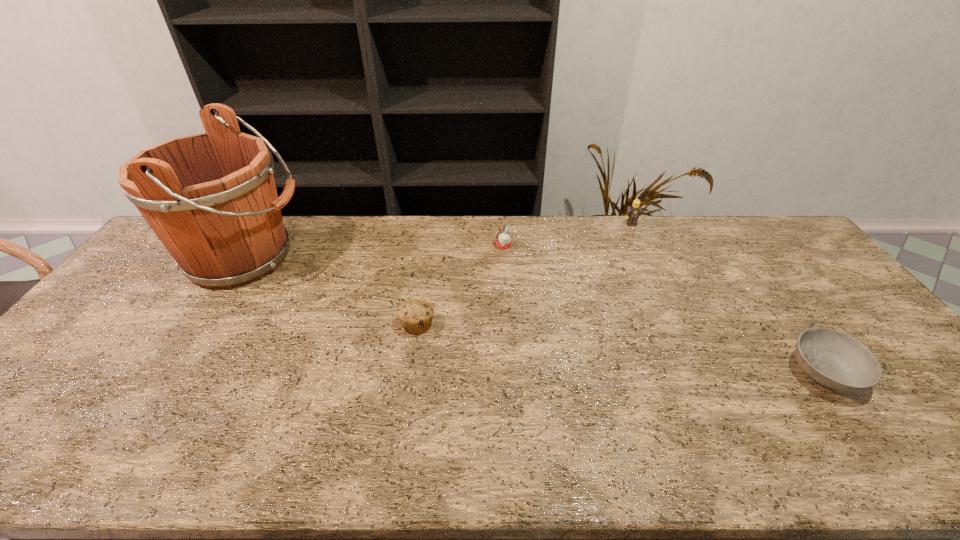
Find the location of a particular element. free space between the right muffin and the nearest object is located at coordinates (664, 309).

This screenshot has width=960, height=540. Identify the location of free spot between the fourth shortest object and the second object from left to right. (524, 274).

At what (x,y) coordinates should I click in order to perform the action: click on free space that is in between the Lego and the second object from left to right. Please return your answer as a coordinate pair (x, y). This screenshot has height=540, width=960. Looking at the image, I should click on (524, 274).

Where is `empty space that is in between the left muffin and the rightmost object`? empty space that is in between the left muffin and the rightmost object is located at coordinates (621, 349).

You are a GUI agent. You are given a task and a screenshot of the screen. Output one action in this format:
    pyautogui.click(x=<x>, y=<y>)
    Task: Click on the vacant area between the second tallest object and the right muffin
    The width and height of the screenshot is (960, 540).
    Given the screenshot: What is the action you would take?
    pyautogui.click(x=567, y=235)

At what (x,y) coordinates should I click in order to perform the action: click on blank region between the bowl and the fourth farthest object. Please return your answer as a coordinate pair (x, y). This screenshot has height=540, width=960. Looking at the image, I should click on (621, 349).

I want to click on free space between the tallest object and the nearer muffin, so click(x=331, y=291).

What are the coordinates of `the third closest object relative to the right muffin` in the screenshot? It's located at (211, 198).

Locate which object is the fourth closest to the leftmost object. Please provide its 2D coordinates. Your answer should be formatted as a tuple, i.e. [(x, y)], where the tuple contains the x and y coordinates of a point satisfying the conditions above.

[(833, 359)]

What are the coordinates of `free space that satisfies the following two spatial constraints: 1. in front of the fourth shortest object; 2. with the handle on the side of the leftmost object` in the screenshot? It's located at (646, 258).